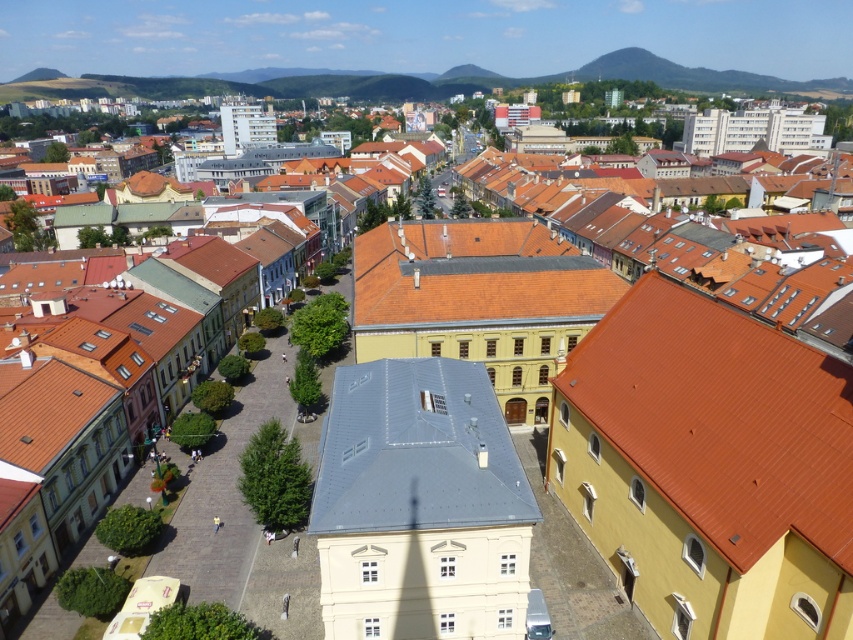
Is gray slate roof at center behind orange tile roof at center?

No, gray slate roof at center is closer to the viewer.

Measure the distance between gray slate roof at center and camera.

gray slate roof at center is 37.16 meters from camera.

At what (x,y) coordinates should I click in order to perform the action: click on gray slate roof at center. Please return your answer as a coordinate pair (x, y). Looking at the image, I should click on (416, 451).

Is orange tile roof at center right bigger than orange tile roof at center?

No, orange tile roof at center right is not bigger than orange tile roof at center.

Does point (775, 516) come closer to viewer compared to point (602, 312)?

That is True.

Between point (688, 465) and point (606, 280), which one is positioned behind?

The point (606, 280) is more distant.

The image size is (853, 640). Identify the location of orange tile roof at center right. [721, 419].

Is point (677, 300) closer to viewer compared to point (457, 492)?

No, (677, 300) is behind (457, 492).

Is orange tile roof at center right further to camera compared to gray slate roof at center?

No, it is in front of gray slate roof at center.

Does point (602, 353) come in front of point (415, 499)?

That is False.

Find the location of a particular element. This screenshot has width=853, height=640. orange tile roof at center right is located at coordinates (721, 419).